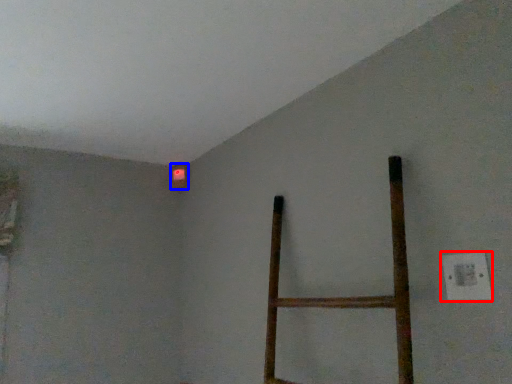
Question: Which object is closer to the camera taking this photo, electric outlet (highlighted by a red box) or lamp (highlighted by a blue box)?

Choices:
 (A) electric outlet
 (B) lamp

Answer: (A)